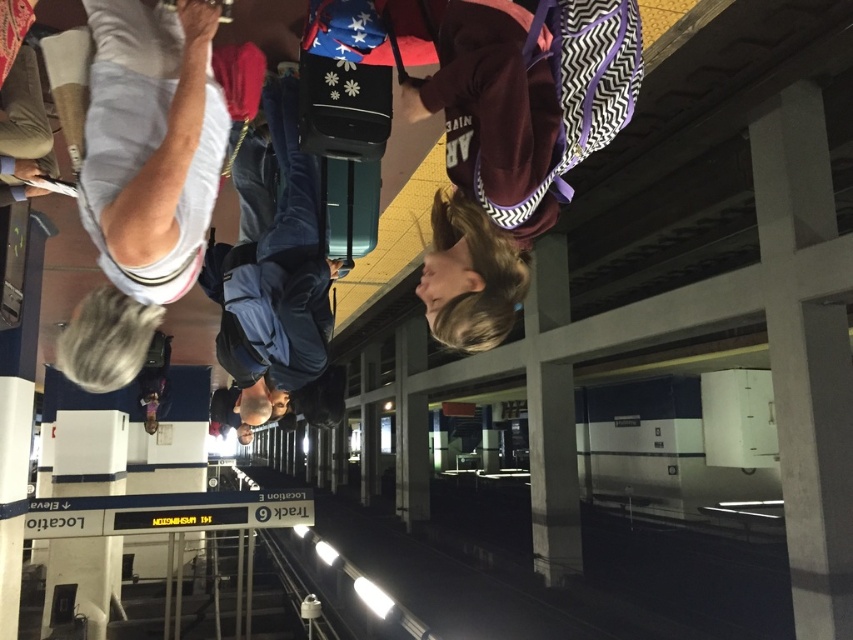
Question: Can you confirm if white fabric shirt at upper left is positioned to the left of dark blue fabric backpack at center?

Choices:
 (A) no
 (B) yes

Answer: (A)

Question: Which point is farther to the camera?

Choices:
 (A) (107, 152)
 (B) (241, 403)

Answer: (B)

Question: Which object appears farthest from the camera in this image?

Choices:
 (A) dark blue fabric backpack at center
 (B) white fabric shirt at upper left

Answer: (A)

Question: Is white fabric shirt at upper left to the right of dark blue fabric backpack at center from the viewer's perspective?

Choices:
 (A) no
 (B) yes

Answer: (B)

Question: Which of the following is the closest to the observer?

Choices:
 (A) (90, 204)
 (B) (247, 243)

Answer: (A)

Question: Observing the image, what is the correct spatial positioning of white fabric shirt at upper left in reference to dark blue fabric backpack at center?

Choices:
 (A) below
 (B) above

Answer: (B)